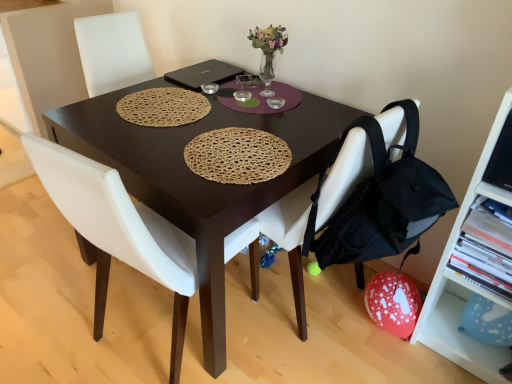
Question: Is the position of black fabric backpack at lower right less distant than that of blue paper balloon at lower right, the 1th shelf ordered from the bottom?

Choices:
 (A) no
 (B) yes

Answer: (B)

Question: From the image's perspective, is black fabric backpack at lower right below blue paper balloon at lower right, which is counted as the 3th shelf, starting from the top?

Choices:
 (A) yes
 (B) no

Answer: (B)

Question: Is black fabric backpack at lower right aimed at blue paper balloon at lower right, the 1th shelf ordered from the bottom?

Choices:
 (A) yes
 (B) no

Answer: (B)

Question: Is black fabric backpack at lower right outside blue paper balloon at lower right, which is counted as the 3th shelf, starting from the top?

Choices:
 (A) no
 (B) yes

Answer: (B)

Question: From a real-world perspective, is black fabric backpack at lower right under blue paper balloon at lower right, the 1th shelf ordered from the bottom?

Choices:
 (A) yes
 (B) no

Answer: (B)

Question: Is white plastic shelf at right, the 2th shelf ordered from the bottom, taller or shorter than dark brown wooden desk at center?

Choices:
 (A) tall
 (B) short

Answer: (A)

Question: Considering the positions of point (493, 193) and point (204, 188), is point (493, 193) closer or farther from the camera than point (204, 188)?

Choices:
 (A) farther
 (B) closer

Answer: (A)

Question: Choose the correct answer: Is white plastic shelf at right, the second shelf in the top-to-bottom sequence, inside dark brown wooden desk at center or outside it?

Choices:
 (A) inside
 (B) outside

Answer: (B)

Question: In the image, is white plastic shelf at right, the 2th shelf ordered from the bottom, on the left side or the right side of dark brown wooden desk at center?

Choices:
 (A) left
 (B) right

Answer: (B)

Question: Considering the positions of white fabric chair at center, which is counted as the first chair, starting from the right, and translucent glass vase at upper center in the image, is white fabric chair at center, which is counted as the first chair, starting from the right, taller or shorter than translucent glass vase at upper center?

Choices:
 (A) tall
 (B) short

Answer: (A)

Question: Considering their positions, is white fabric chair at center, which is counted as the first chair, starting from the right, located in front of or behind translucent glass vase at upper center?

Choices:
 (A) behind
 (B) front

Answer: (B)

Question: Considering the positions of white fabric chair at center, positioned as the second chair in left-to-right order, and translucent glass vase at upper center in the image, is white fabric chair at center, positioned as the second chair in left-to-right order, wider or thinner than translucent glass vase at upper center?

Choices:
 (A) wide
 (B) thin

Answer: (A)

Question: Is white fabric chair at center, which is counted as the first chair, starting from the right, inside or outside of translucent glass vase at upper center?

Choices:
 (A) inside
 (B) outside

Answer: (B)

Question: Is blue paper balloon at lower right, the 1th shelf ordered from the bottom, in front of or behind black fabric backpack at lower right in the image?

Choices:
 (A) behind
 (B) front

Answer: (A)

Question: Considering the positions of blue paper balloon at lower right, the 1th shelf ordered from the bottom, and black fabric backpack at lower right in the image, is blue paper balloon at lower right, the 1th shelf ordered from the bottom, bigger or smaller than black fabric backpack at lower right?

Choices:
 (A) small
 (B) big

Answer: (A)